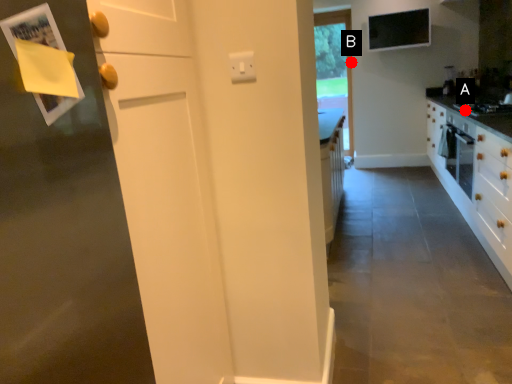
Question: Two points are circled on the image, labeled by A and B beside each circle. Among these points, which one is farthest from the camera?

Choices:
 (A) A is further
 (B) B is further

Answer: (B)